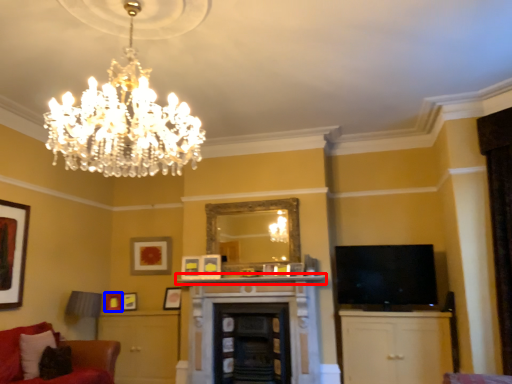
Question: Among these objects, which one is farthest to the camera, mantle (highlighted by a red box) or picture frame (highlighted by a blue box)?

Choices:
 (A) mantle
 (B) picture frame

Answer: (B)